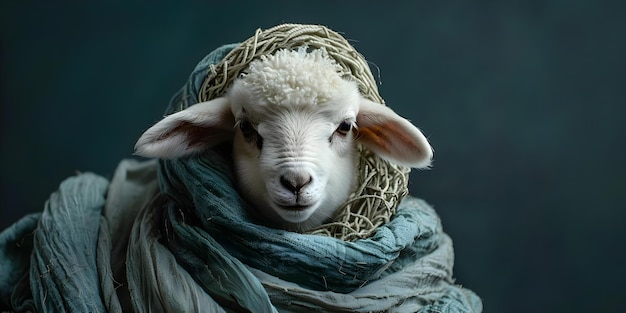
This screenshot has height=313, width=626. Find the location of `fabric`. fabric is located at coordinates (188, 260).